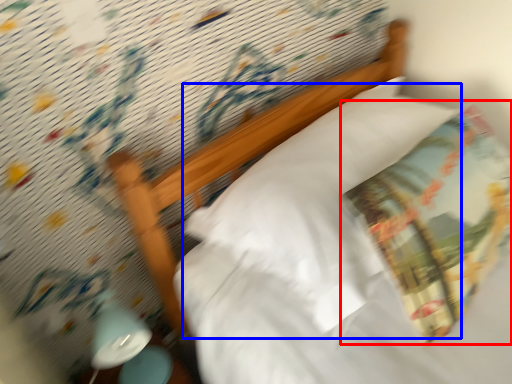
Question: Among these objects, which one is nearest to the camera, throw pillow (highlighted by a red box) or pillow (highlighted by a blue box)?

Choices:
 (A) throw pillow
 (B) pillow

Answer: (A)